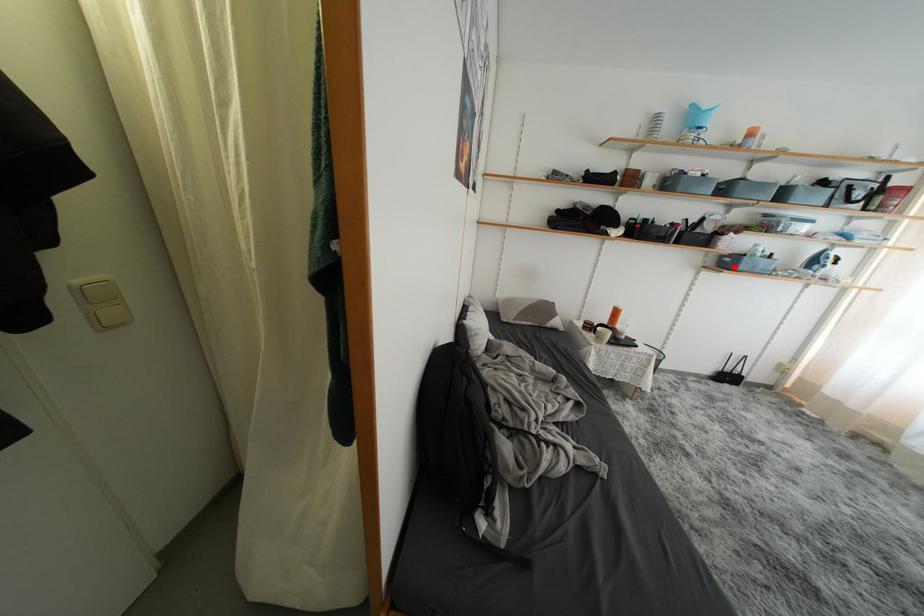
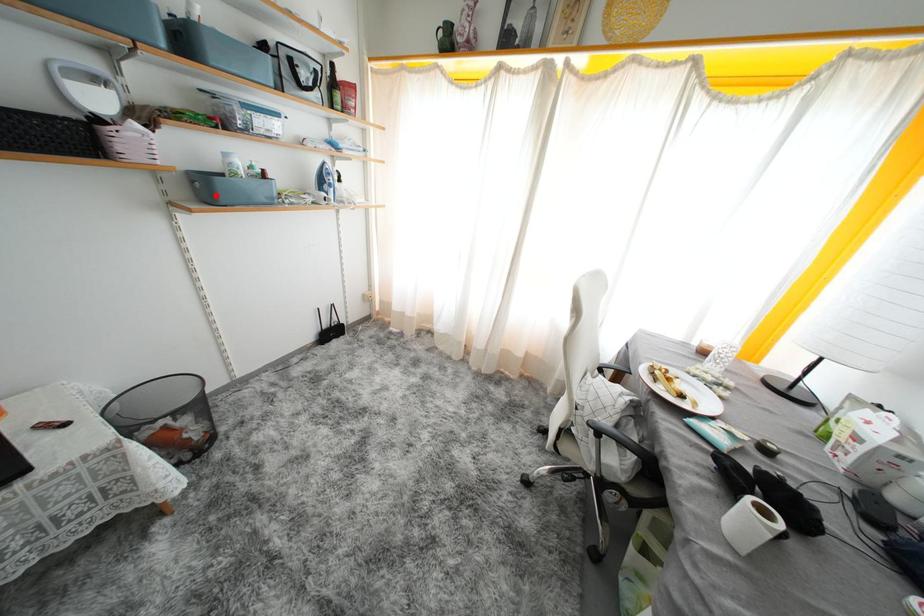
I am providing you with two images of the same scene from different viewpoints. A red point is marked on the first image and another point is marked on the second image. Do the highlighted points in image1 and image2 indicate the same real-world spot?

Yes